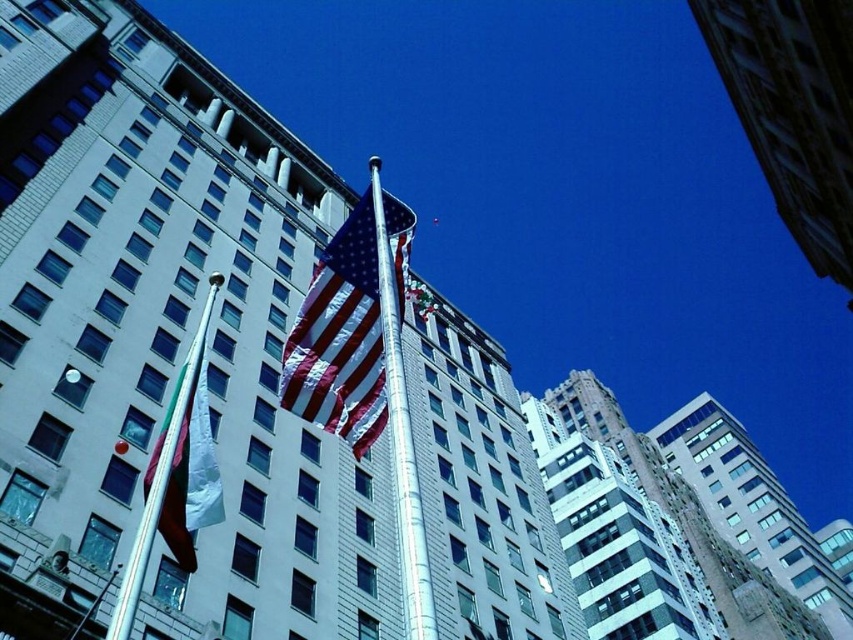
Question: Does polished silver pole at center appear over white fabric flag at left?

Choices:
 (A) no
 (B) yes

Answer: (A)

Question: Which point is farther from the camera taking this photo?

Choices:
 (A) (410, 561)
 (B) (196, 513)
 (C) (396, 291)
 (D) (190, 515)

Answer: (C)

Question: Considering the real-world distances, which object is closest to the white fabric flag at left?

Choices:
 (A) american flag at center
 (B) polished silver pole at center
 (C) silver metallic flag pole at upper center

Answer: (C)

Question: Does american flag at center appear on the right side of polished silver pole at center?

Choices:
 (A) yes
 (B) no

Answer: (B)

Question: Which of these objects is positioned closest to the american flag at center?

Choices:
 (A) white fabric flag at left
 (B) silver metallic flag pole at upper center

Answer: (B)

Question: Can you confirm if american flag at center is positioned below silver metallic flag pole at upper center?

Choices:
 (A) no
 (B) yes

Answer: (A)